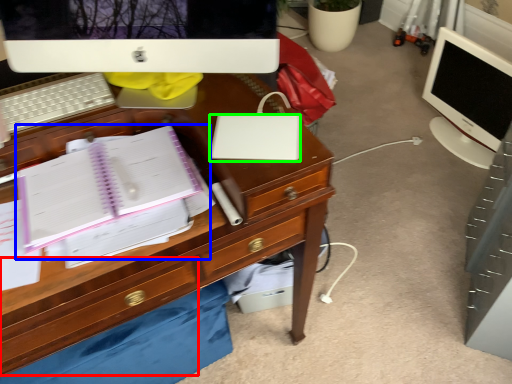
Question: Based on their relative distances, which object is farther from drawer (highlighted by a red box)? Choose from notebook (highlighted by a blue box) and laptop (highlighted by a green box).

Choices:
 (A) notebook
 (B) laptop

Answer: (B)